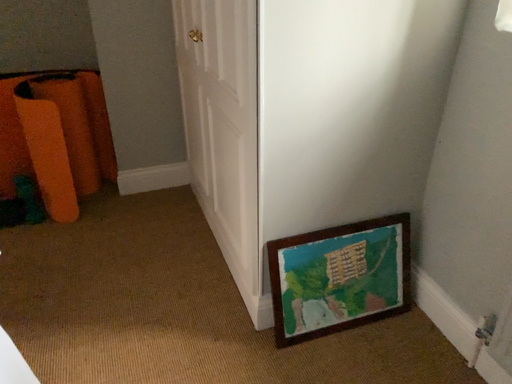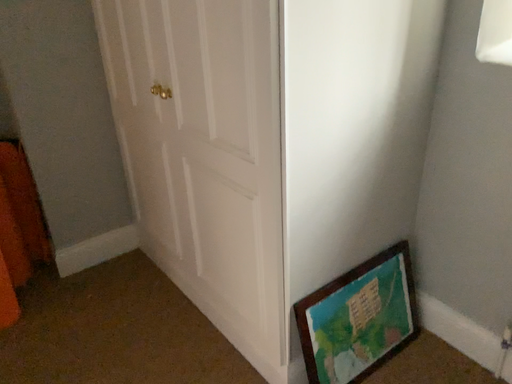
Question: How did the camera likely rotate when shooting the video?

Choices:
 (A) rotated right
 (B) rotated left

Answer: (A)